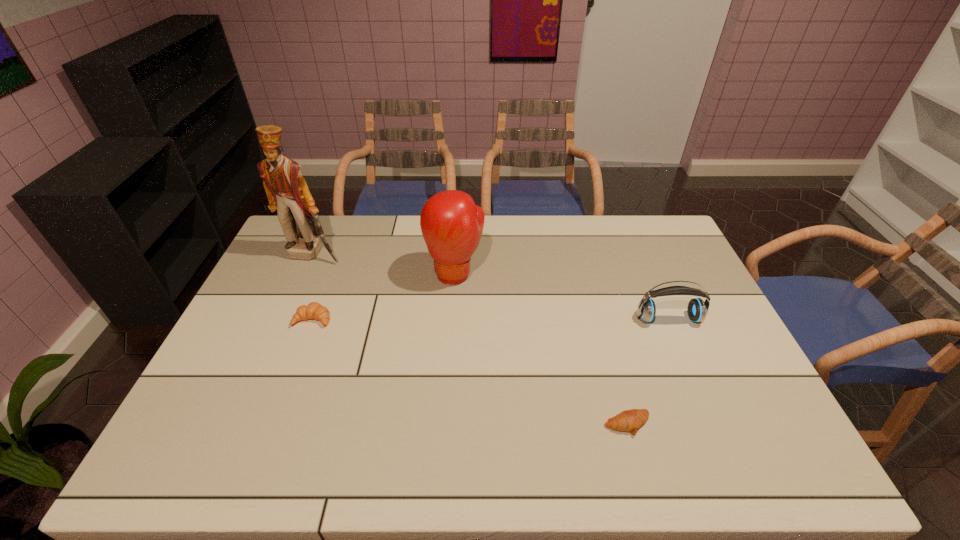
Identify the location of vacant space in between the tallest object and the rightmost object. The image size is (960, 540). (x=491, y=286).

Locate an element on the screen. This screenshot has height=540, width=960. free space that is in between the rightmost object and the shorter crescent roll is located at coordinates (648, 372).

This screenshot has width=960, height=540. Identify the location of vacant area between the fourth shortest object and the tallest object. (384, 264).

Identify the location of the second closest object to the left crescent roll. The image size is (960, 540). (451, 224).

Locate which object ranks in proximity to the fourth shortest object. Please provide its 2D coordinates. Your answer should be formatted as a tuple, i.e. [(x, y)], where the tuple contains the x and y coordinates of a point satisfying the conditions above.

[(314, 310)]

This screenshot has width=960, height=540. I want to click on vacant region that satisfies the following two spatial constraints: 1. on the striking surface of the boxing glove; 2. on the right side of the nearer crescent roll, so click(446, 424).

The width and height of the screenshot is (960, 540). I want to click on vacant space that satisfies the following two spatial constraints: 1. on the front side of the shortest object; 2. on the left side of the farther crescent roll, so click(273, 424).

At what (x,y) coordinates should I click in order to perform the action: click on free spot that satisfies the following two spatial constraints: 1. on the striking surface of the third object from left to right; 2. on the right side of the right crescent roll. Please return your answer as a coordinate pair (x, y). Image resolution: width=960 pixels, height=540 pixels. Looking at the image, I should click on (446, 424).

Image resolution: width=960 pixels, height=540 pixels. What are the coordinates of `free region that satisfies the following two spatial constraints: 1. on the front-facing side of the farther crescent roll; 2. on the right side of the tallest object` in the screenshot? It's located at (284, 319).